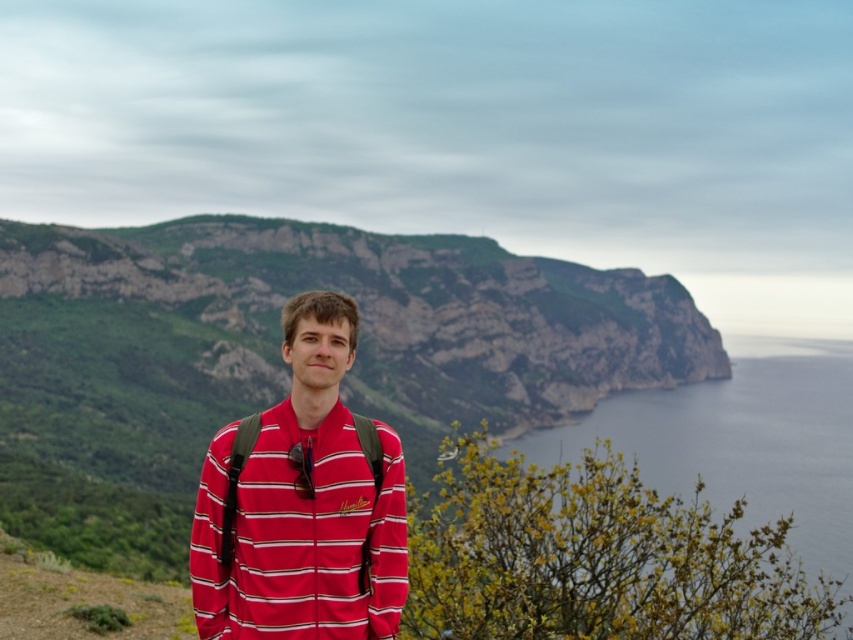
Is green textured rock at center above smooth blue water at lower right?

Indeed, green textured rock at center is positioned over smooth blue water at lower right.

Is green textured rock at center to the left of smooth blue water at lower right from the viewer's perspective?

Indeed, green textured rock at center is positioned on the left side of smooth blue water at lower right.

Is point (355, 401) farther from camera compared to point (717, 508)?

Yes.

Locate an element on the screen. green textured rock at center is located at coordinates (280, 358).

Which of these two, red striped shirt at center or smooth blue water at lower right, stands shorter?

red striped shirt at center

Is point (322, 323) farther from camera compared to point (746, 481)?

No, (322, 323) is closer to viewer.

Where is `red striped shirt at center`? The image size is (853, 640). red striped shirt at center is located at coordinates (302, 502).

Is green textured rock at center bigger than red striped shirt at center?

Yes, green textured rock at center is bigger than red striped shirt at center.

Between green textured rock at center and red striped shirt at center, which one is positioned higher?

green textured rock at center is higher up.

What do you see at coordinates (280, 358) in the screenshot?
I see `green textured rock at center` at bounding box center [280, 358].

This screenshot has height=640, width=853. Find the location of `green textured rock at center`. green textured rock at center is located at coordinates click(x=280, y=358).